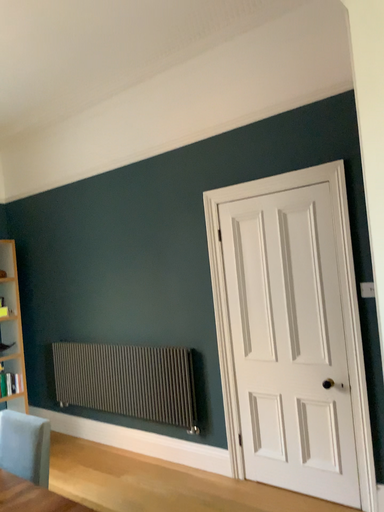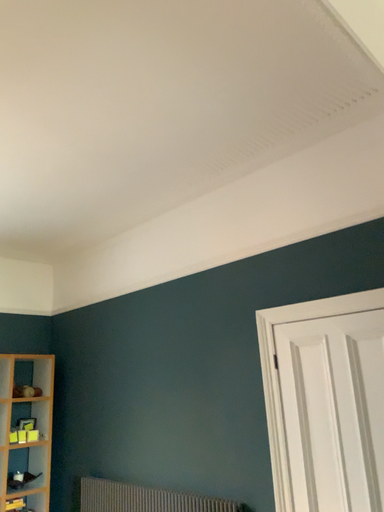
Question: Which way did the camera rotate in the video?

Choices:
 (A) rotated downward
 (B) rotated upward

Answer: (B)